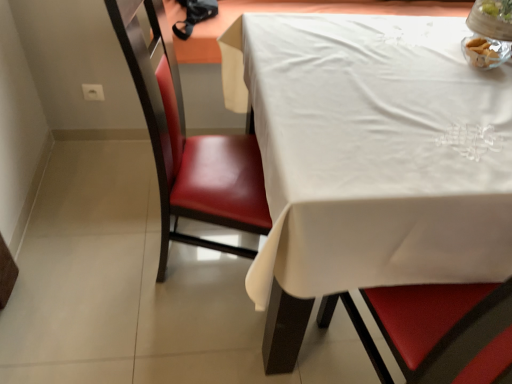
The width and height of the screenshot is (512, 384). What are the coordinates of `free space above white cloth at upper right (from a real-world perspective)` in the screenshot? It's located at (405, 93).